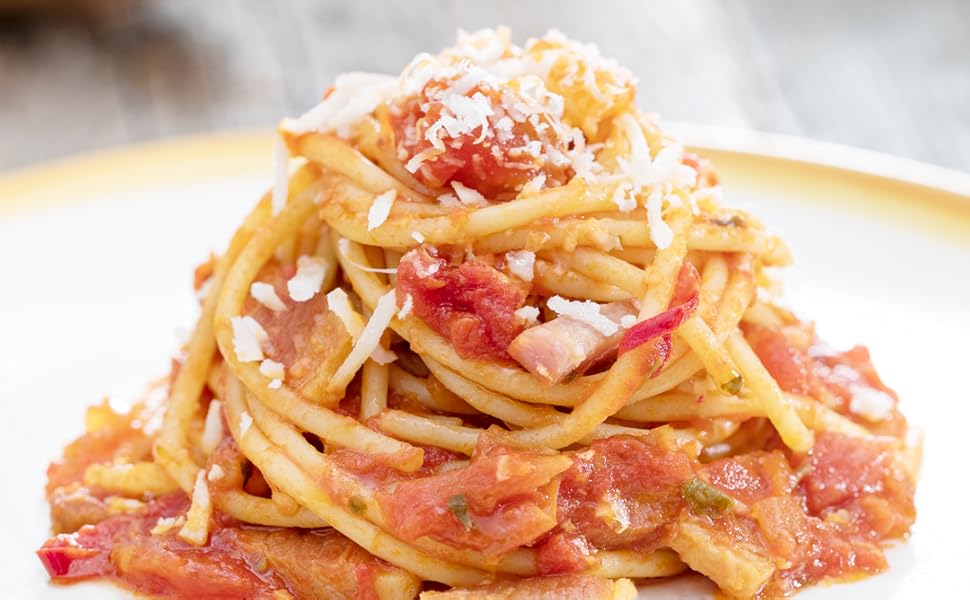
Locate an element on the screen. white plate is located at coordinates (118, 249).